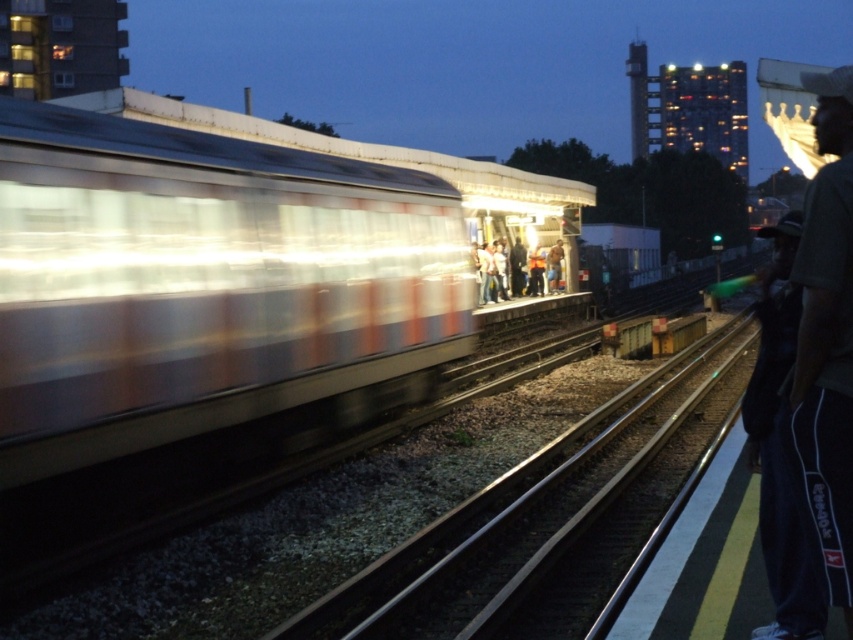
You are a photographer standing on the train station platform. You see two people in the scene, one wearing dark gray reebok track pants at right and another wearing blue jeans at center. Which of these two individuals is wearing clothing that might be wider?

The dark gray reebok track pants at right might be wider than the blue jeans at center.

Based on the photo, you are a photographer at the train station. You want to capture a photo that includes both the metallic silver train at left and the dark gray reebok track pants at right. Which object should you focus on first to ensure both are in frame?

You should focus on the dark gray reebok track pants at right first because the metallic silver train at left occupies less space, so adjusting the frame to include the larger dark gray reebok track pants at right will naturally include the smaller metallic silver train at left.